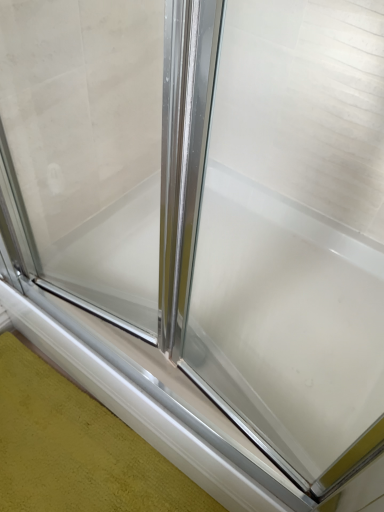
The height and width of the screenshot is (512, 384). Describe the element at coordinates (170, 393) in the screenshot. I see `white glossy window sill at lower center` at that location.

The width and height of the screenshot is (384, 512). In order to click on white glossy window sill at lower center in this screenshot , I will do click(x=170, y=393).

This screenshot has height=512, width=384. Describe the element at coordinates (86, 150) in the screenshot. I see `clear glass shower door at center` at that location.

This screenshot has width=384, height=512. Find the location of `clear glass shower door at center`. clear glass shower door at center is located at coordinates (86, 150).

The height and width of the screenshot is (512, 384). What are the coordinates of `white glossy window sill at lower center` in the screenshot? It's located at (170, 393).

Which object is positioned more to the right, white glossy window sill at lower center or clear glass shower door at center?

clear glass shower door at center is more to the right.

Which object is further away from the camera, white glossy window sill at lower center or clear glass shower door at center?

Positioned behind is white glossy window sill at lower center.

Considering the positions of point (94, 321) and point (25, 69), is point (94, 321) closer or farther from the camera than point (25, 69)?

Point (94, 321) is positioned farther from the camera compared to point (25, 69).

From the image's perspective, which one is positioned higher, white glossy window sill at lower center or clear glass shower door at center?

clear glass shower door at center, from the image's perspective.

From a real-world perspective, is white glossy window sill at lower center over clear glass shower door at center?

No.

Considering the sizes of objects white glossy window sill at lower center and clear glass shower door at center in the image provided, who is thinner, white glossy window sill at lower center or clear glass shower door at center?

Thinner between the two is clear glass shower door at center.

Between white glossy window sill at lower center and clear glass shower door at center, which one has more height?

clear glass shower door at center is taller.

In terms of size, does white glossy window sill at lower center appear bigger or smaller than clear glass shower door at center?

In the image, white glossy window sill at lower center appears to be smaller than clear glass shower door at center.

Is white glossy window sill at lower center inside the boundaries of clear glass shower door at center, or outside?

white glossy window sill at lower center is outside clear glass shower door at center.

Is the surface of white glossy window sill at lower center in direct contact with clear glass shower door at center?

No, white glossy window sill at lower center is not beside clear glass shower door at center.

Is white glossy window sill at lower center turned away from clear glass shower door at center?

No, white glossy window sill at lower center's orientation is not away from clear glass shower door at center.

What's the angular difference between white glossy window sill at lower center and clear glass shower door at center's facing directions?

The facing directions of white glossy window sill at lower center and clear glass shower door at center are 9.98 degrees apart.

I want to click on window sill on the left of clear glass shower door at center, so click(170, 393).

Considering the relative positions of clear glass shower door at center and white glossy window sill at lower center in the image provided, is clear glass shower door at center to the right of white glossy window sill at lower center from the viewer's perspective?

Yes.

Does clear glass shower door at center come behind white glossy window sill at lower center?

That is False.

Is point (148, 103) more distant than point (122, 347)?

Yes.

From the image's perspective, which is below, clear glass shower door at center or white glossy window sill at lower center?

white glossy window sill at lower center is shown below in the image.

From a real-world perspective, is clear glass shower door at center positioned above or below white glossy window sill at lower center?

Clearly, from a real-world perspective, clear glass shower door at center is above white glossy window sill at lower center.

Considering the sizes of clear glass shower door at center and white glossy window sill at lower center in the image, is clear glass shower door at center wider or thinner than white glossy window sill at lower center?

Clearly, clear glass shower door at center has less width compared to white glossy window sill at lower center.

Which of these two, clear glass shower door at center or white glossy window sill at lower center, stands taller?

clear glass shower door at center is taller.

Can you confirm if clear glass shower door at center is smaller than white glossy window sill at lower center?

Incorrect, clear glass shower door at center is not smaller in size than white glossy window sill at lower center.

Would you say clear glass shower door at center contains white glossy window sill at lower center?

No, white glossy window sill at lower center is not inside clear glass shower door at center.

Is the surface of clear glass shower door at center in direct contact with white glossy window sill at lower center?

clear glass shower door at center is not next to white glossy window sill at lower center, and they're not touching.

Could you tell me if clear glass shower door at center is turned towards white glossy window sill at lower center?

No, clear glass shower door at center is not facing towards white glossy window sill at lower center.

How different are the orientations of clear glass shower door at center and white glossy window sill at lower center in degrees?

9.98 degrees.

The width and height of the screenshot is (384, 512). I want to click on window screen above the white glossy window sill at lower center (from the image's perspective), so click(x=86, y=150).

This screenshot has height=512, width=384. I want to click on window screen located in front of the white glossy window sill at lower center, so click(86, 150).

This screenshot has height=512, width=384. What are the coordinates of `window sill on the left of clear glass shower door at center` in the screenshot? It's located at (170, 393).